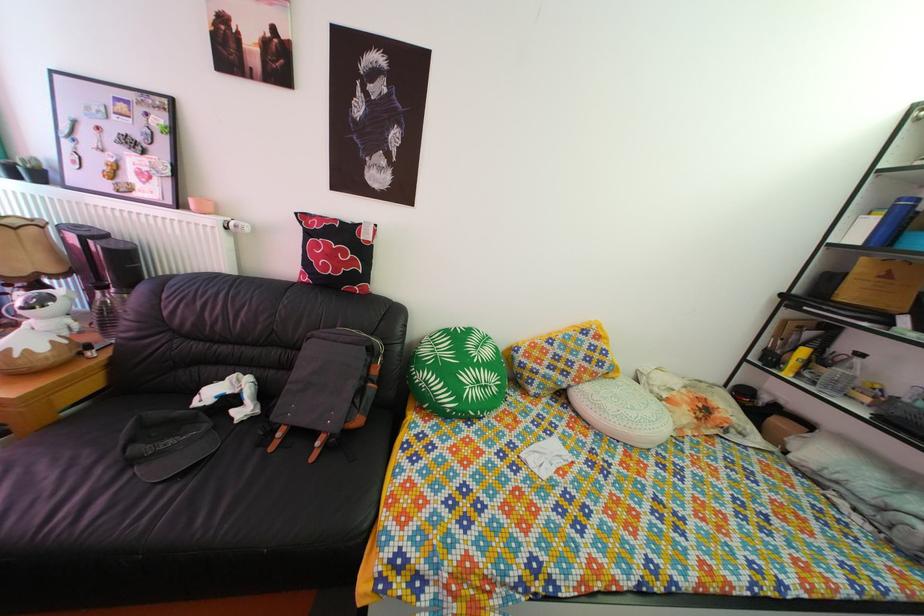
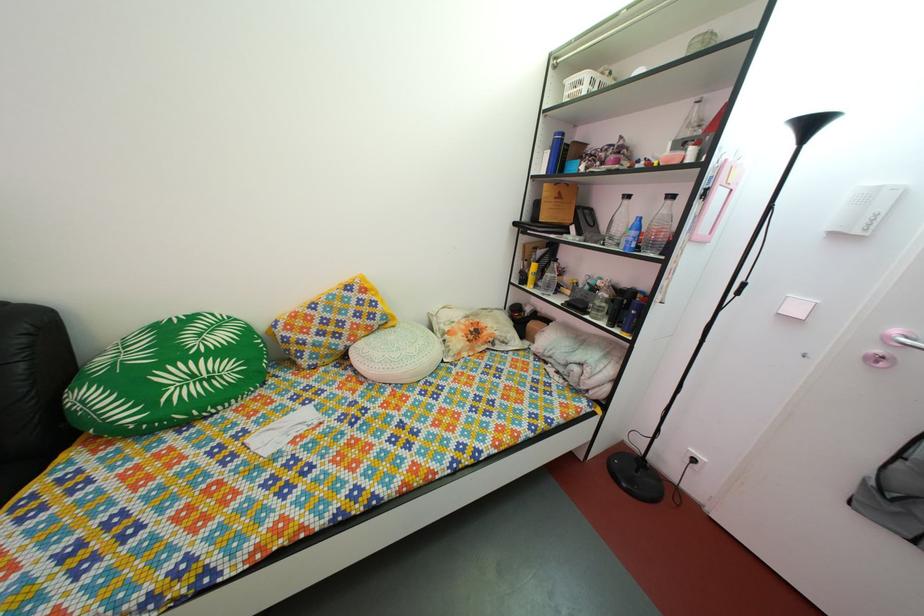
In the second image, find the point that corresponds to (x=494, y=395) in the first image.

(220, 387)